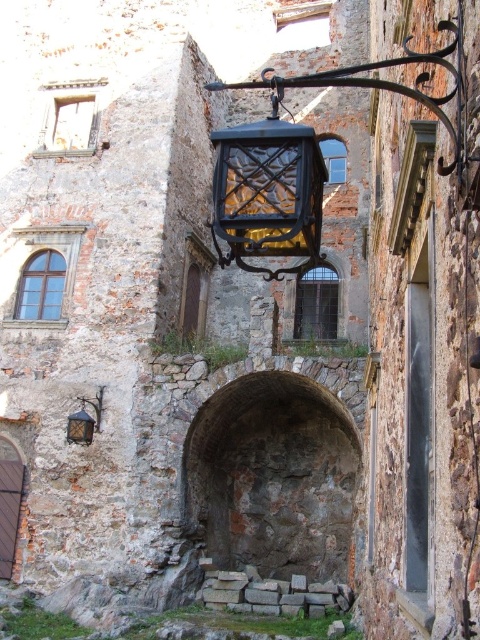
Question: Which point is closer to the camera?

Choices:
 (A) (83, 433)
 (B) (291, 188)
 (C) (240, 468)

Answer: (B)

Question: Is matte black lantern at center above matte black lantern at lower left?

Choices:
 (A) yes
 (B) no

Answer: (A)

Question: Which of the following is the closest to the observer?

Choices:
 (A) matte black lantern at lower left
 (B) matte black lantern at center

Answer: (B)

Question: Is matte black lantern at center bigger than matte black lantern at lower left?

Choices:
 (A) no
 (B) yes

Answer: (B)

Question: Does rustic stone archway at center have a larger size compared to matte black lantern at center?

Choices:
 (A) no
 (B) yes

Answer: (A)

Question: Which point is farther to the camera?

Choices:
 (A) (216, 544)
 (B) (83, 422)
 (C) (218, 168)

Answer: (A)